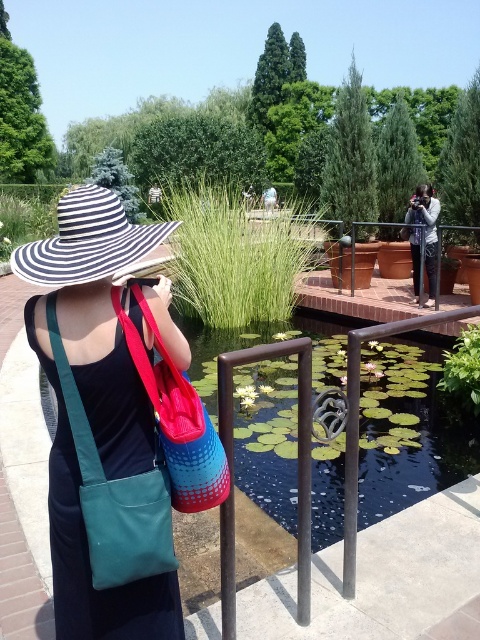
Question: Which object appears farthest from the camera in this image?

Choices:
 (A) matte blue bag at center
 (B) matte black camera at center

Answer: (B)

Question: Does matte blue bag at center appear under matte black camera at center?

Choices:
 (A) no
 (B) yes

Answer: (B)

Question: Which point appears closest to the camera in this image?

Choices:
 (A) (106, 369)
 (B) (421, 193)

Answer: (A)

Question: Which point appears closest to the camera in this image?

Choices:
 (A) (412, 212)
 (B) (145, 424)

Answer: (B)

Question: Is matte blue bag at center to the left of matte black camera at center from the viewer's perspective?

Choices:
 (A) no
 (B) yes

Answer: (B)

Question: Can you confirm if matte blue bag at center is wider than matte black camera at center?

Choices:
 (A) yes
 (B) no

Answer: (A)